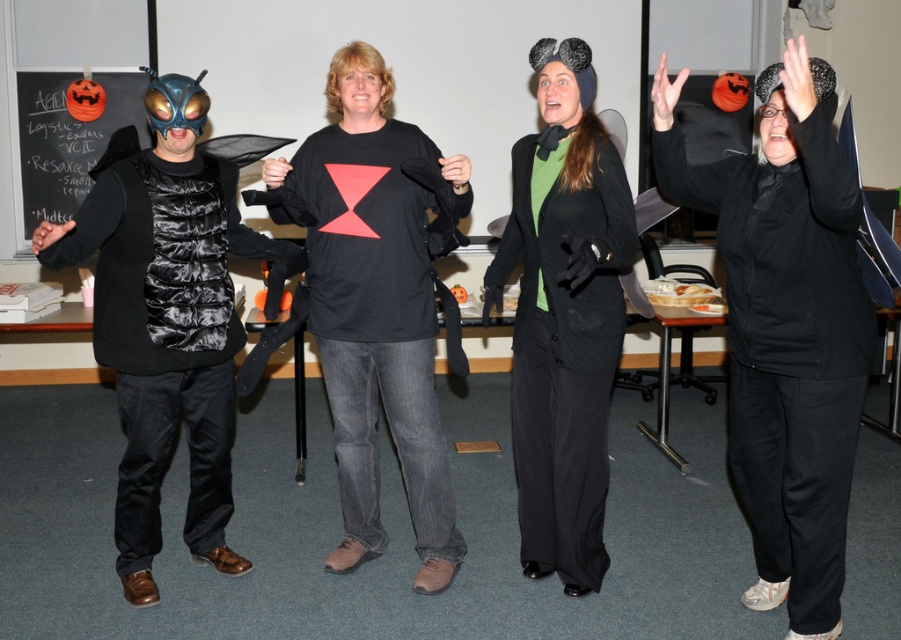
In the scene shown: You are a photographer trying to capture a group photo of the shiny black vest at left and the matte black coat at center. You need to ensure that both are in focus. Given that your camera has a depth of field that can cover 1.2 meters, will you be able to capture both subjects clearly?

The shiny black vest at left and the matte black coat at center are 1.00 meters apart from each other. Since the camera has a depth of field of 1.2 meters, which is greater than the distance between them, both subjects will be in focus.